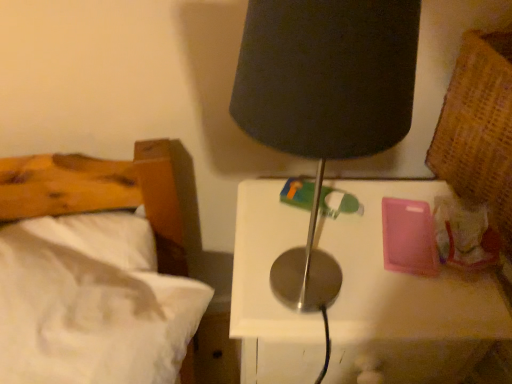
At what (x,y) coordinates should I click in order to perform the action: click on metallic white nightstand at center. Please return your answer as a coordinate pair (x, y). Looking at the image, I should click on (404, 299).

What is the approximate height of metallic white nightstand at center?

The height of metallic white nightstand at center is 26.83 inches.

The width and height of the screenshot is (512, 384). What do you see at coordinates (324, 102) in the screenshot? I see `black fabric lamp at upper center` at bounding box center [324, 102].

Where is `black fabric lamp at upper center`? black fabric lamp at upper center is located at coordinates (324, 102).

Identify the location of metallic white nightstand at center. The height and width of the screenshot is (384, 512). (404, 299).

Is metallic white nightstand at center a part of white soft bed at left?

No, white soft bed at left does not contain metallic white nightstand at center.

Which object is closer to the camera, white soft bed at left or metallic white nightstand at center?

white soft bed at left is closer to the camera.

From the image's perspective, relative to metallic white nightstand at center, is white soft bed at left above or below?

white soft bed at left is above metallic white nightstand at center.

Is white soft bed at left taller than metallic white nightstand at center?

In fact, white soft bed at left may be shorter than metallic white nightstand at center.

From the image's perspective, relative to white soft bed at left, is black fabric lamp at upper center above or below?

black fabric lamp at upper center is above white soft bed at left.

Can you confirm if black fabric lamp at upper center is taller than white soft bed at left?

Correct, black fabric lamp at upper center is much taller as white soft bed at left.

In the scene shown: Is black fabric lamp at upper center thinner than white soft bed at left?

Correct, the width of black fabric lamp at upper center is less than that of white soft bed at left.

Which of these two, metallic white nightstand at center or white soft bed at left, is bigger?

With larger size is metallic white nightstand at center.

Is metallic white nightstand at center surrounding white soft bed at left?

No, white soft bed at left is not a part of metallic white nightstand at center.

From the image's perspective, which is below, metallic white nightstand at center or white soft bed at left?

metallic white nightstand at center appears lower in the image.

Does metallic white nightstand at center touch white soft bed at left?

There is a gap between metallic white nightstand at center and white soft bed at left.

Considering the positions of objects black fabric lamp at upper center and metallic white nightstand at center in the image provided, who is more to the left, black fabric lamp at upper center or metallic white nightstand at center?

black fabric lamp at upper center.

Does black fabric lamp at upper center have a lesser height compared to metallic white nightstand at center?

Correct, black fabric lamp at upper center is not as tall as metallic white nightstand at center.

From the picture: Which of these two, white soft bed at left or black fabric lamp at upper center, is thinner?

black fabric lamp at upper center.

You are a GUI agent. You are given a task and a screenshot of the screen. Output one action in this format:
    pyautogui.click(x=<x>, y=<y>)
    Task: Click on the lamp that appears above the white soft bed at left (from the image's perspective)
    The image size is (512, 384).
    Given the screenshot: What is the action you would take?
    pyautogui.click(x=324, y=102)

Does point (371, 320) come in front of point (395, 38)?

No, (371, 320) is further to viewer.

Where is `nightstand below the black fabric lamp at upper center (from the image's perspective)`? The height and width of the screenshot is (384, 512). nightstand below the black fabric lamp at upper center (from the image's perspective) is located at coordinates (404, 299).

Which of these two, metallic white nightstand at center or black fabric lamp at upper center, is bigger?

metallic white nightstand at center is bigger.

How different are the orientations of metallic white nightstand at center and black fabric lamp at upper center in degrees?

The angle between the facing direction of metallic white nightstand at center and the facing direction of black fabric lamp at upper center is 5.35e-05 degrees.

Locate an element on the screen. bed on the left of metallic white nightstand at center is located at coordinates (101, 192).

Image resolution: width=512 pixels, height=384 pixels. Find the location of `lamp that is above the white soft bed at left (from the image's perspective)`. lamp that is above the white soft bed at left (from the image's perspective) is located at coordinates (324, 102).

Estimate the real-world distances between objects in this image. Which object is closer to metallic white nightstand at center, white soft bed at left or black fabric lamp at upper center?

white soft bed at left.

Looking at the image, which one is located further to metallic white nightstand at center, black fabric lamp at upper center or white soft bed at left?

black fabric lamp at upper center is positioned further to the anchor metallic white nightstand at center.

When comparing their distances from black fabric lamp at upper center, does white soft bed at left or metallic white nightstand at center seem further?

white soft bed at left is further to black fabric lamp at upper center.

Which object lies further to the anchor point black fabric lamp at upper center, metallic white nightstand at center or white soft bed at left?

The object further to black fabric lamp at upper center is white soft bed at left.

Estimate the real-world distances between objects in this image. Which object is further from white soft bed at left, metallic white nightstand at center or black fabric lamp at upper center?

The object further to white soft bed at left is black fabric lamp at upper center.

Estimate the real-world distances between objects in this image. Which object is closer to white soft bed at left, black fabric lamp at upper center or metallic white nightstand at center?

metallic white nightstand at center lies closer to white soft bed at left than the other object.

Find the location of `lamp between white soft bed at left and metallic white nightstand at center`. lamp between white soft bed at left and metallic white nightstand at center is located at coordinates (324, 102).